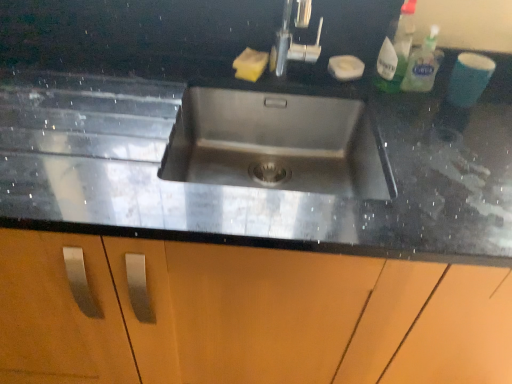
Where is `free spot in front of white matte soap at upper right, which is the 2th soap from left to right`? The height and width of the screenshot is (384, 512). free spot in front of white matte soap at upper right, which is the 2th soap from left to right is located at coordinates (378, 104).